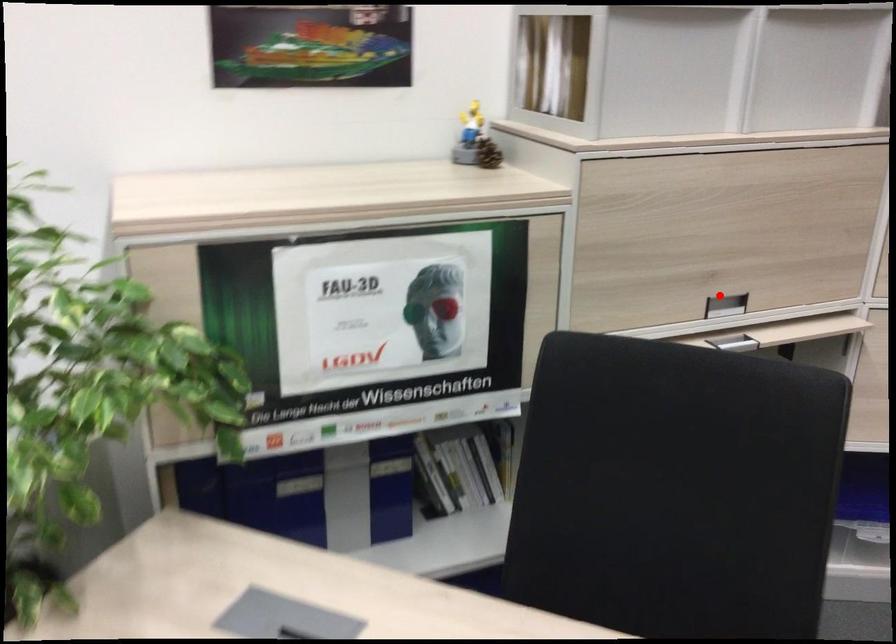
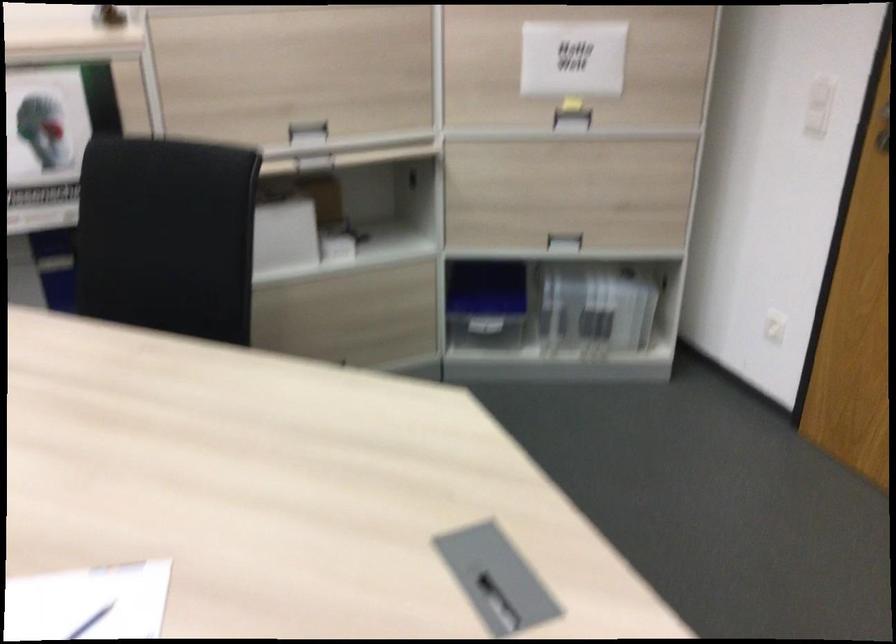
In the second image, find the point that corresponds to the highlighted location in the first image.

(307, 129)